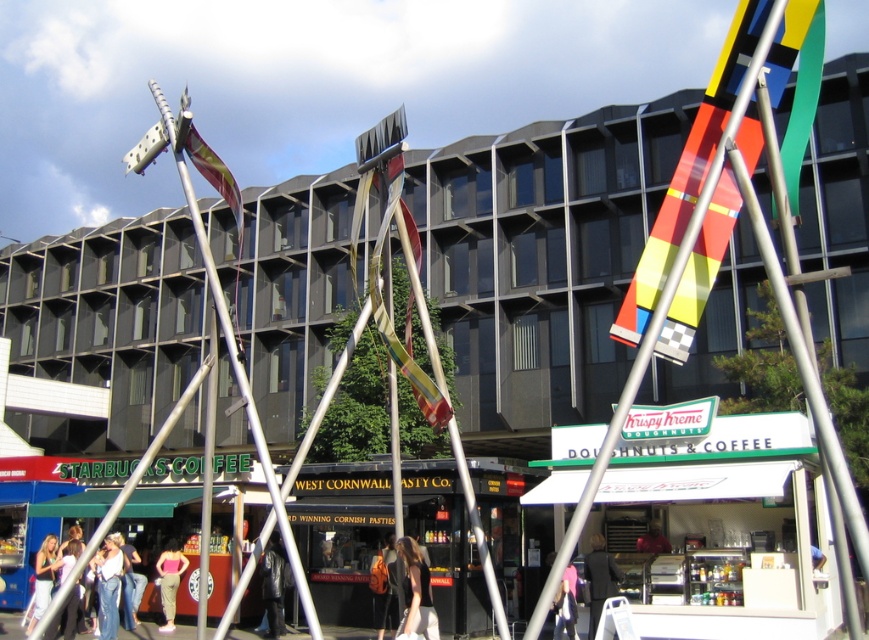
Who is more forward, [274,576] or [565,618]?

Point [565,618] is in front.

Based on the photo, who is positioned more to the left, leather jacket at center or pink fabric at lower center?

From the viewer's perspective, leather jacket at center appears more on the left side.

Which is in front, point (284, 579) or point (575, 620)?

Point (575, 620)

Identify the location of leather jacket at center. (273, 584).

Does pink fabric at lower center have a lesser height compared to red shirt at center?

No.

Is point (572, 584) positioned behind point (640, 541)?

No, it is in front of (640, 541).

Identify the location of pink fabric at lower center. This screenshot has width=869, height=640. (566, 604).

Can you confirm if matte pink top at center is positioned below pink fabric at lower center?

Correct, matte pink top at center is located below pink fabric at lower center.

Can you confirm if matte pink top at center is positioned above pink fabric at lower center?

Incorrect, matte pink top at center is not positioned above pink fabric at lower center.

You are a GUI agent. You are given a task and a screenshot of the screen. Output one action in this format:
    pyautogui.click(x=<x>, y=<y>)
    Task: Click on the matte pink top at center
    Image resolution: width=869 pixels, height=640 pixels.
    Given the screenshot: What is the action you would take?
    pyautogui.click(x=169, y=580)